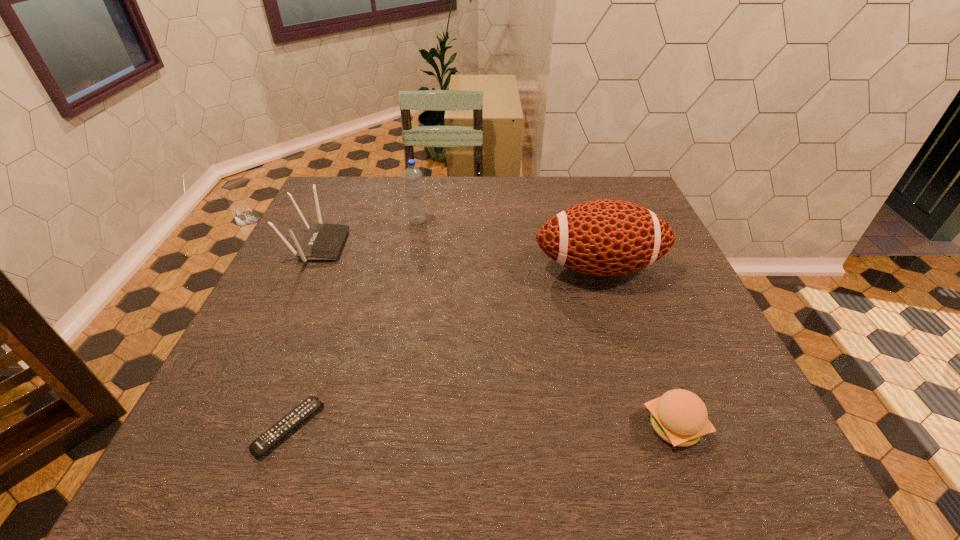
Find the location of a particular element. The height and width of the screenshot is (540, 960). water bottle is located at coordinates (412, 175).

Identify the location of football. (607, 237).

Where is `the third shortest object`? Image resolution: width=960 pixels, height=540 pixels. the third shortest object is located at coordinates (323, 241).

Locate an element on the screen. the fourth tallest object is located at coordinates (680, 417).

Locate an element on the screen. remote control is located at coordinates (289, 422).

In order to click on vacant space located 0.130m on the left of the water bottle in this screenshot , I will do `click(364, 220)`.

Identify the location of vacant space situated on the back of the football. (579, 204).

The width and height of the screenshot is (960, 540). What are the coordinates of `free spot located 0.220m on the front-facing side of the third shortest object` in the screenshot? It's located at (426, 245).

This screenshot has height=540, width=960. In order to click on free space located on the back of the fourth tallest object in this screenshot , I will do `click(654, 369)`.

At what (x,y) coordinates should I click in order to perform the action: click on free point located 0.100m on the right of the shortest object. Please return your answer as a coordinate pair (x, y). Looking at the image, I should click on (374, 427).